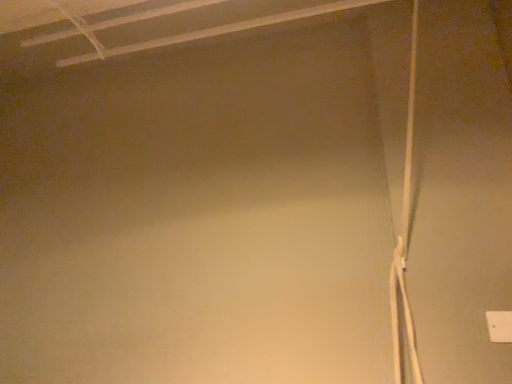
Find the location of a particular element. The image size is (512, 384). white plastic power plug at lower right is located at coordinates (499, 326).

Image resolution: width=512 pixels, height=384 pixels. What do you see at coordinates (499, 326) in the screenshot? I see `white plastic power plug at lower right` at bounding box center [499, 326].

Identify the location of white plastic power plug at lower right. (499, 326).